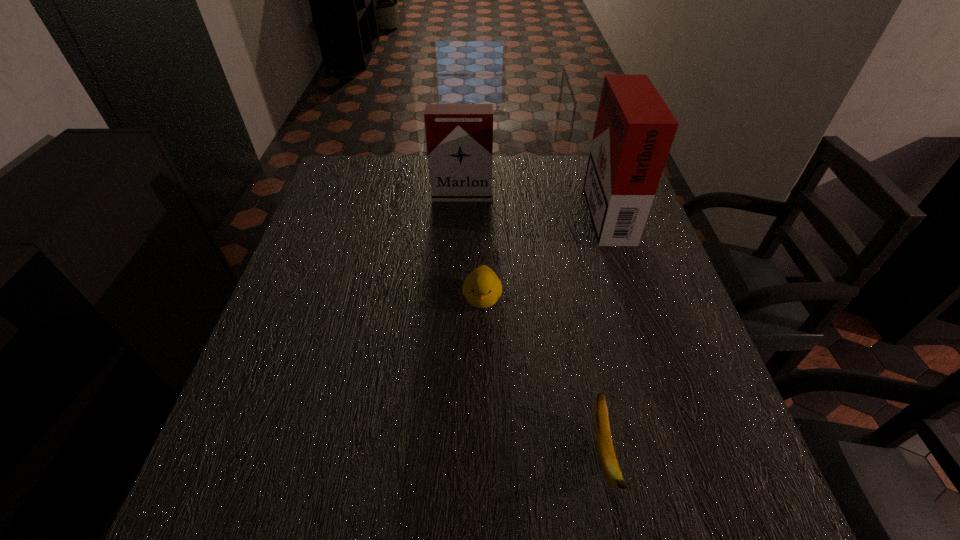
Identify the location of the right cigarette_case. This screenshot has width=960, height=540. (634, 131).

The image size is (960, 540). I want to click on the rightmost object, so click(x=634, y=131).

I want to click on the second tallest object, so click(x=459, y=137).

You are a GUI agent. You are given a task and a screenshot of the screen. Output one action in this format:
    pyautogui.click(x=<x>, y=<y>)
    Task: Click on the left cigarette_case
    
    Given the screenshot: What is the action you would take?
    pyautogui.click(x=459, y=137)

I want to click on the second shortest object, so click(x=482, y=288).

Locate an element on the screen. Image resolution: width=960 pixels, height=540 pixels. the second nearest object is located at coordinates (482, 288).

Locate an element on the screen. This screenshot has height=540, width=960. banana is located at coordinates (610, 467).

The width and height of the screenshot is (960, 540). In order to click on the nearest object in this screenshot , I will do `click(610, 467)`.

I want to click on vacant area situated on the front-facing side of the taller cigarette_case, so click(x=471, y=208).

Where is `vacant space located 0.190m on the front-facing side of the taller cigarette_case`? The height and width of the screenshot is (540, 960). vacant space located 0.190m on the front-facing side of the taller cigarette_case is located at coordinates (520, 208).